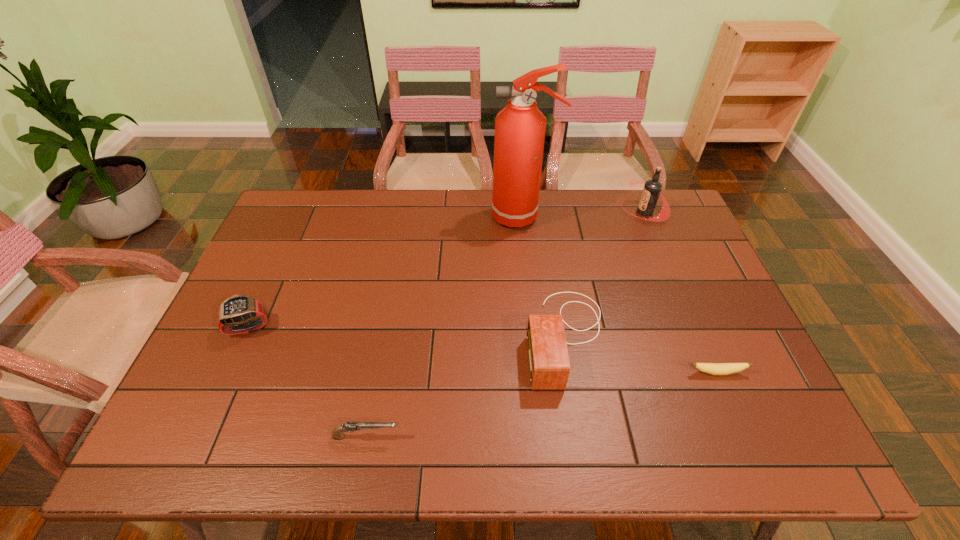
At what (x,y) coordinates should I click in order to perform the action: click on the tallest object. Please return your answer as a coordinate pair (x, y). Image resolution: width=960 pixels, height=540 pixels. Looking at the image, I should click on (520, 127).

You are a GUI agent. You are given a task and a screenshot of the screen. Output one action in this format:
    pyautogui.click(x=<x>, y=<y>)
    Task: Click on the root beer
    The height and width of the screenshot is (540, 960).
    Given the screenshot: What is the action you would take?
    pyautogui.click(x=652, y=189)

This screenshot has height=540, width=960. Identify the location of radio receiver. (549, 367).

In order to click on the leftmost object in this screenshot , I will do tap(239, 308).

Where is `gun`? gun is located at coordinates click(337, 434).

Where is `the nearest object`? Image resolution: width=960 pixels, height=540 pixels. the nearest object is located at coordinates (337, 434).

Where is `banana`? banana is located at coordinates (711, 368).

Identify the location of vacant space located 0.310m at the nozzle of the fire extinguisher. (400, 217).

The image size is (960, 540). What are the coordinates of `vacant area situated 0.090m at the nozzle of the fire extinguisher` in the screenshot? It's located at (465, 217).

This screenshot has height=540, width=960. I want to click on vacant point located 0.260m at the nozzle of the fire extinguisher, so click(x=416, y=217).